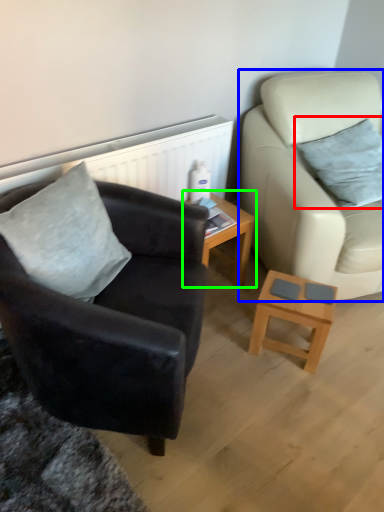
Question: Which object is the closest to the pillow (highlighted by a red box)? Choose among these: studio couch (highlighted by a blue box) or table (highlighted by a green box).

Choices:
 (A) studio couch
 (B) table

Answer: (A)